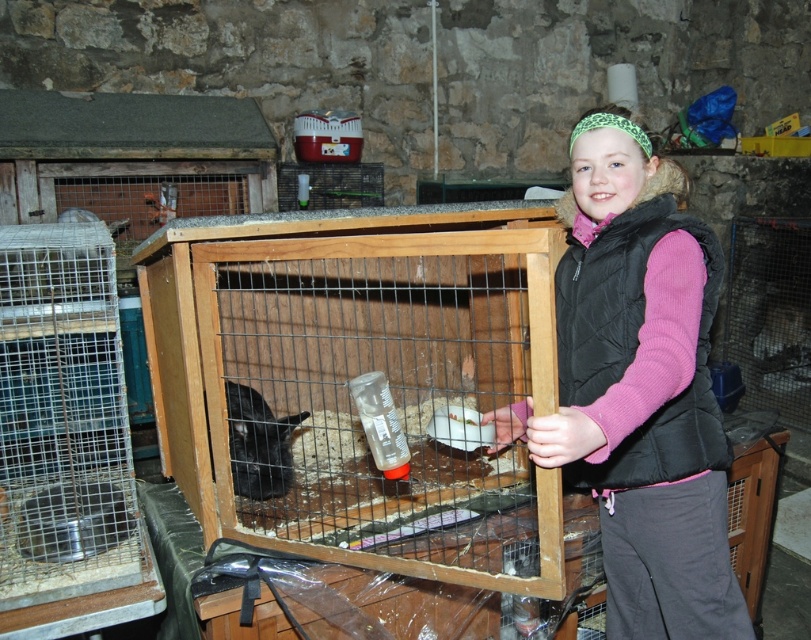
Is the position of black quilted vest at center less distant than that of black fur rabbit at center?

Yes, black quilted vest at center is in front of black fur rabbit at center.

Which is in front, point (503, 408) or point (282, 445)?

Point (503, 408)

Measure the distance between point (668, 561) and camera.

They are 1.62 meters apart.

Find the location of a particular element. Image resolution: width=811 pixels, height=640 pixels. black quilted vest at center is located at coordinates (638, 392).